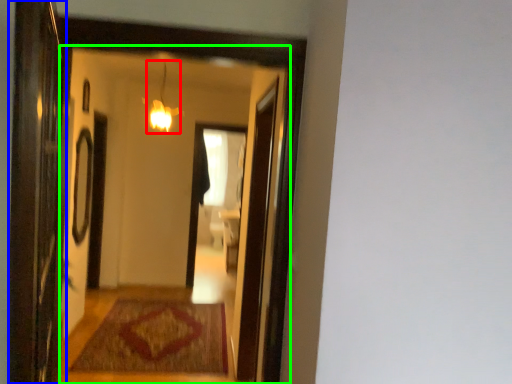
Question: Based on their relative distances, which object is farther from light fixture (highlighted by a red box)? Choose from screen door (highlighted by a blue box) and mirror (highlighted by a green box).

Choices:
 (A) screen door
 (B) mirror

Answer: (A)